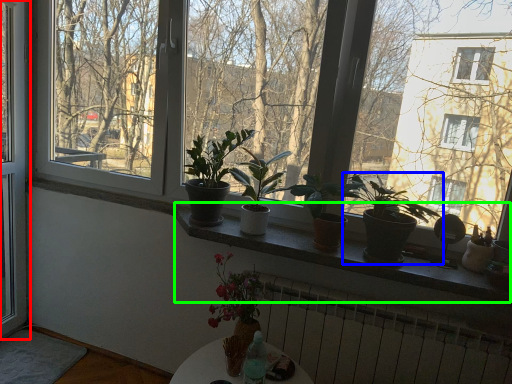
Question: Considering the real-world distances, which object is farthest from window (highlighted by a red box)? houseplant (highlighted by a blue box) or window sill (highlighted by a green box)?

Choices:
 (A) houseplant
 (B) window sill

Answer: (A)